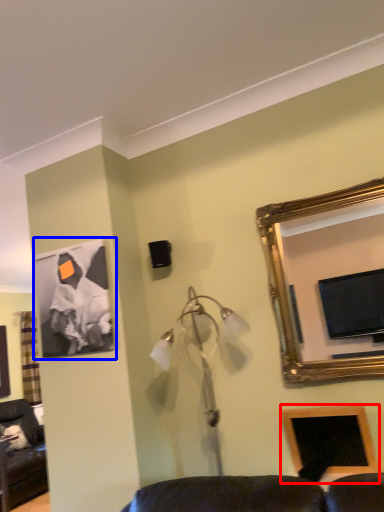
Question: Which object appears closest to the camera in this image, picture frame (highlighted by a red box) or picture frame (highlighted by a blue box)?

Choices:
 (A) picture frame
 (B) picture frame

Answer: (A)